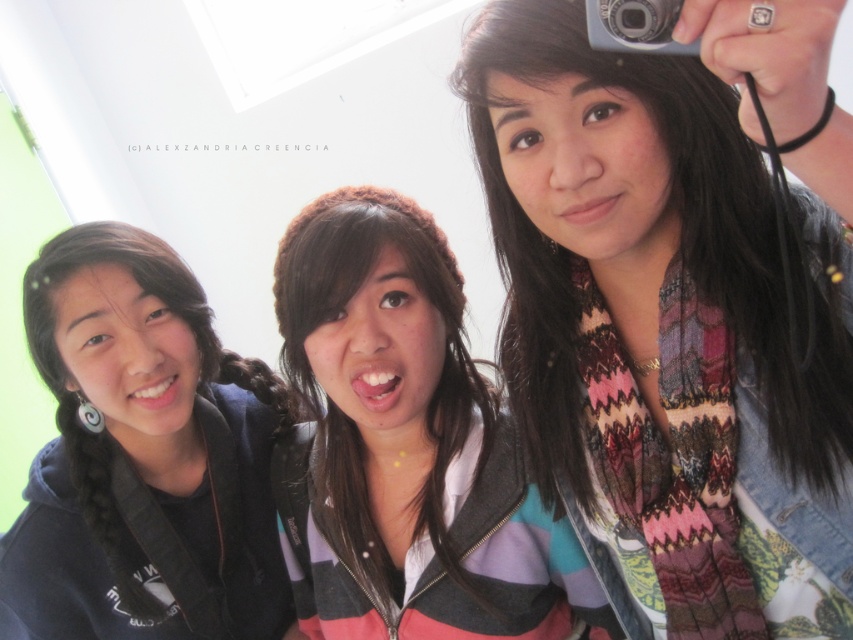
You are organizing a costume party and need to choose accessories based on their sizes. You have a multicolored scarf at center and a black matte hoodie at left. Which accessory is bigger?

The multicolored scarf at center is larger in size compared to the black matte hoodie at left according to the description.

Consider the image. You are standing in the room and see the point marked at coordinates (405, 445). Which object in the scene is this point located on?

The point marked at coordinates (405, 445) is located on the striped hoodie at center.